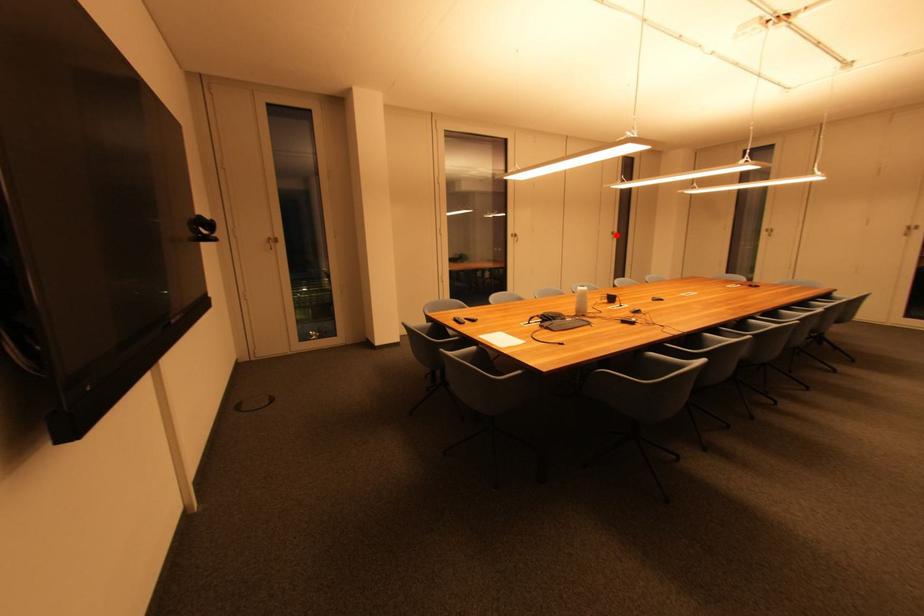
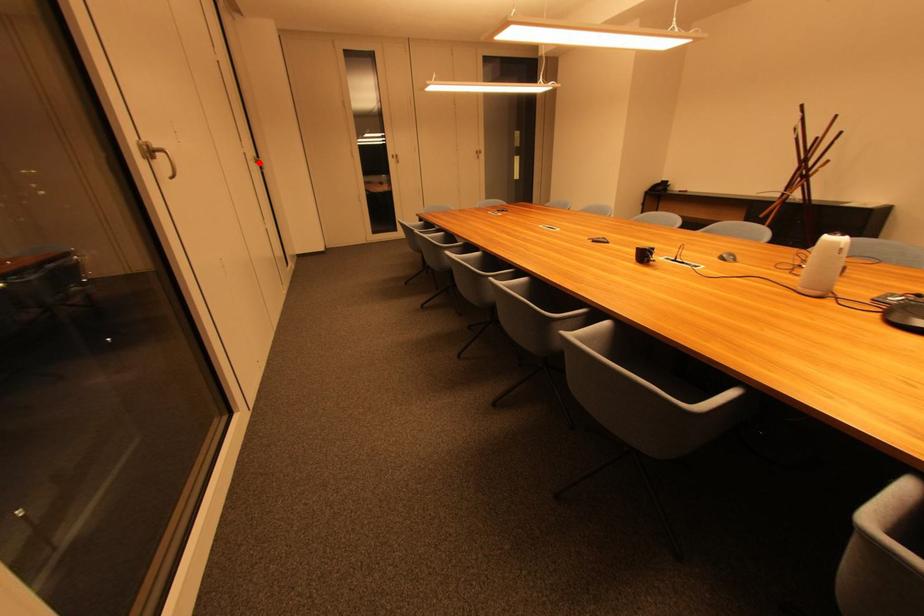
I am providing you with two images of the same scene from different viewpoints. A red point is marked on the first image and another point is marked on the second image. Are the points marked in image1 and image2 representing the same 3D position?

Yes